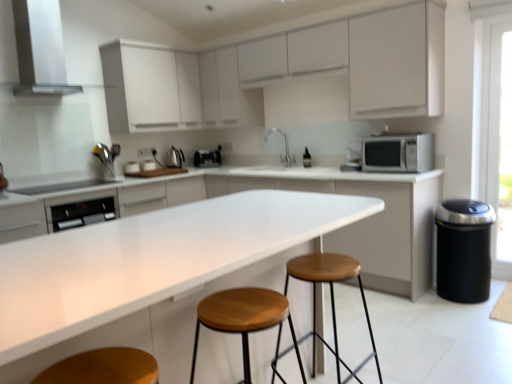
Locate an element on the screen. The height and width of the screenshot is (384, 512). free space in front of black matte trash can at lower right, acting as the fourth appliance starting from the top is located at coordinates (472, 317).